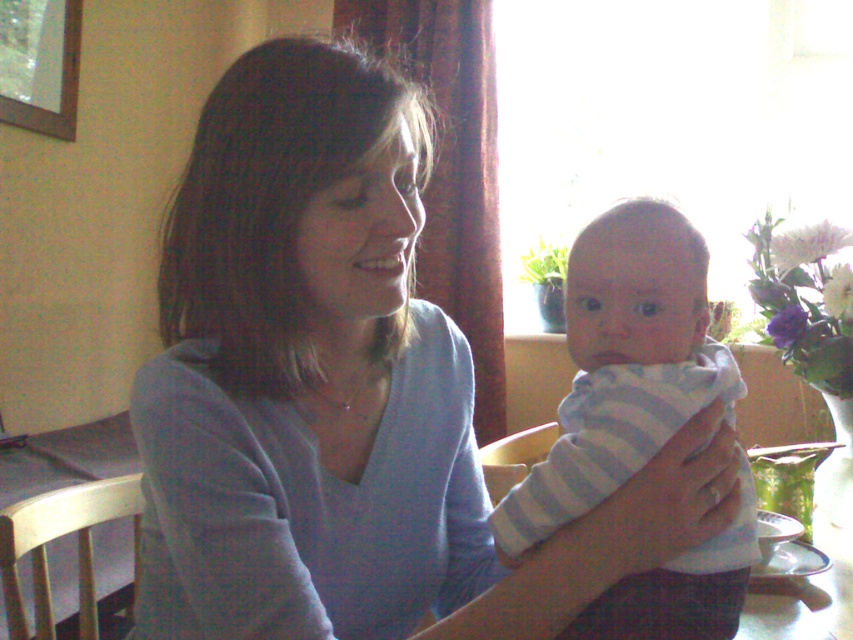
Does matte blue sweater at center lie behind light blue striped cloth at center?

No, it is not.

Who is more forward, (270, 358) or (711, 566)?

Point (270, 358) is more forward.

Does point (383, 339) lie in front of point (625, 605)?

No.

Identify the location of matte blue sweater at center. (344, 394).